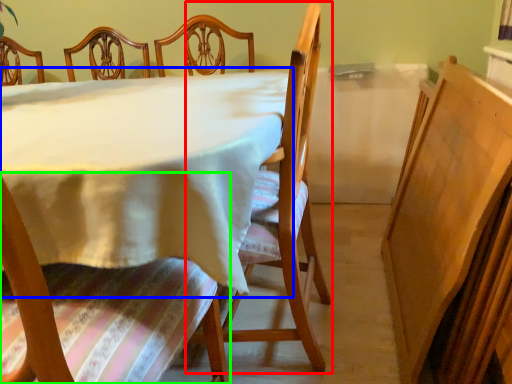
Question: Which is nearer to the chair (highlighted by a red box)? table (highlighted by a blue box) or chair (highlighted by a green box).

Choices:
 (A) table
 (B) chair

Answer: (A)